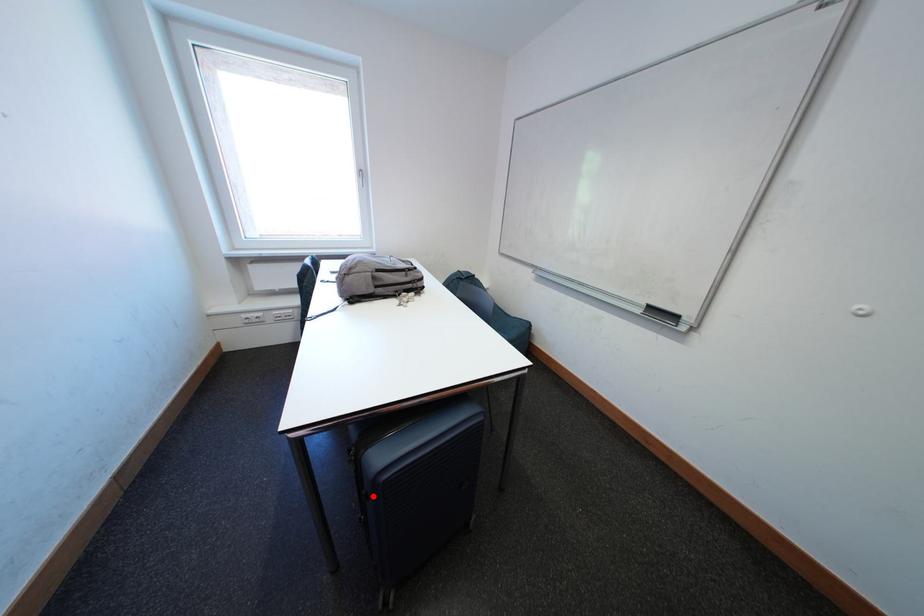
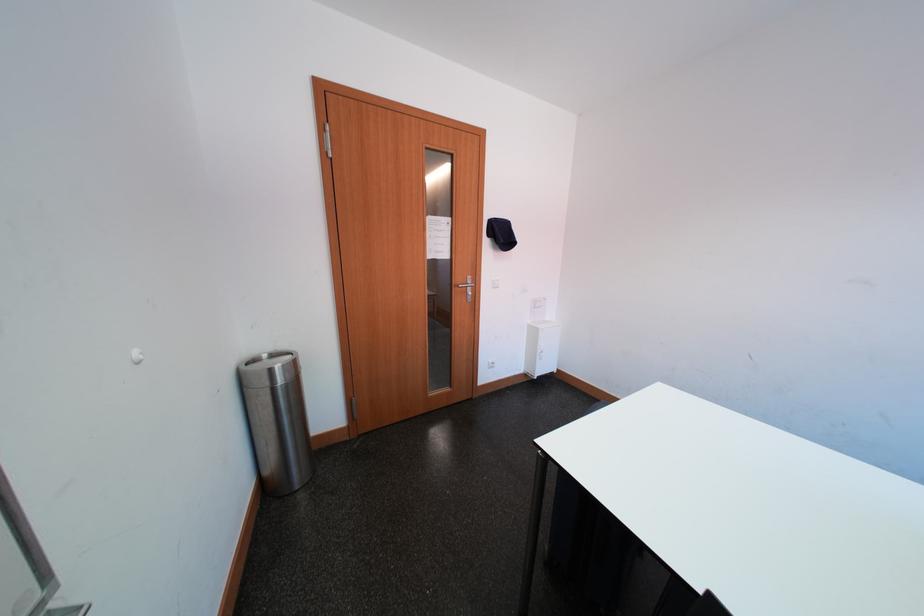
Question: I am providing you with two images of the same scene from different viewpoints. A red point is marked on the first image. Can you still see the location of the red point in image 2?

Choices:
 (A) Yes
 (B) No

Answer: (B)